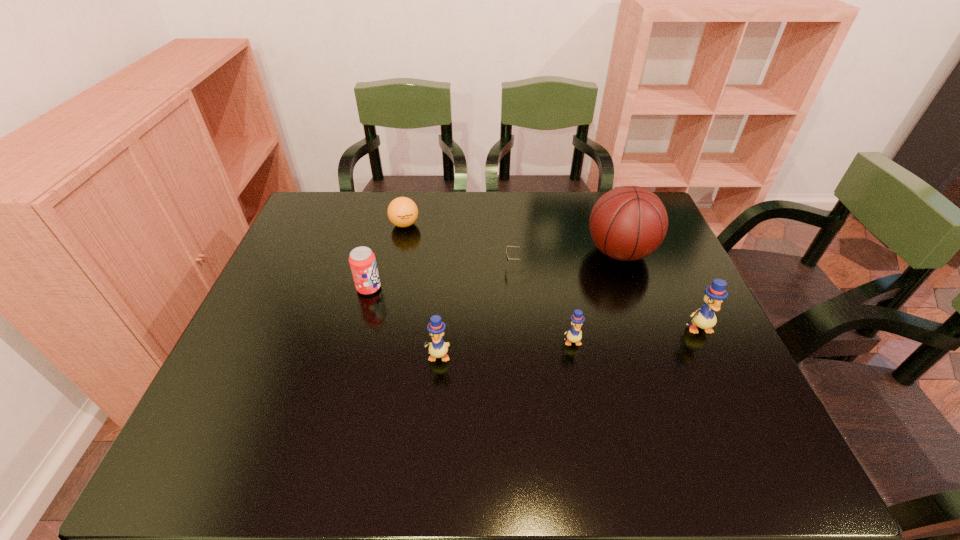
The image size is (960, 540). In order to click on soda can in this screenshot , I will do `click(362, 261)`.

At what (x,y) coordinates should I click in order to perform the action: click on vacant space located 0.080m on the face of the leftmost duckling, where the monocle is placed. Please return your answer as a coordinate pair (x, y). Looking at the image, I should click on (435, 396).

At what (x,y) coordinates should I click in order to perform the action: click on free spot located 0.070m on the face of the third object from right to left, where the monocle is placed. Please return your answer as a coordinate pair (x, y). Looking at the image, I should click on (578, 373).

Locate an element on the screen. This screenshot has width=960, height=540. vacant space located 0.210m on the face of the sixth shortest object, where the monocle is placed is located at coordinates (740, 417).

The image size is (960, 540). Find the location of `free spot located 0.070m on the back of the basketball`. free spot located 0.070m on the back of the basketball is located at coordinates (608, 218).

The width and height of the screenshot is (960, 540). What are the coordinates of `free space located 0.120m in front of the lenses of the fourth object from left to right` in the screenshot? It's located at (462, 266).

You are a GUI agent. You are given a task and a screenshot of the screen. Output one action in this format:
    pyautogui.click(x=<x>, y=<y>)
    Task: Click on the vacant position located in front of the lenses of the fourth object from left to right
    
    Given the screenshot: What is the action you would take?
    pyautogui.click(x=422, y=266)

In order to click on free space located in front of the lenses of the fourth object from left to right in this screenshot , I will do `click(383, 266)`.

Where is `vacant space situated on the side with brand of the ping-pong ball`? This screenshot has height=540, width=960. vacant space situated on the side with brand of the ping-pong ball is located at coordinates (387, 311).

Identify the location of vacant space located 0.140m on the surface of the soda can. (434, 288).